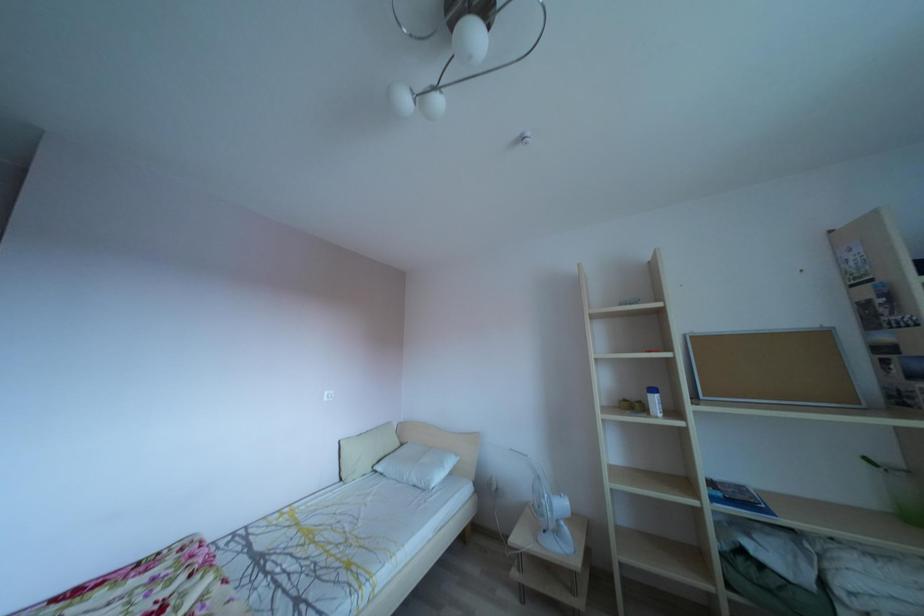
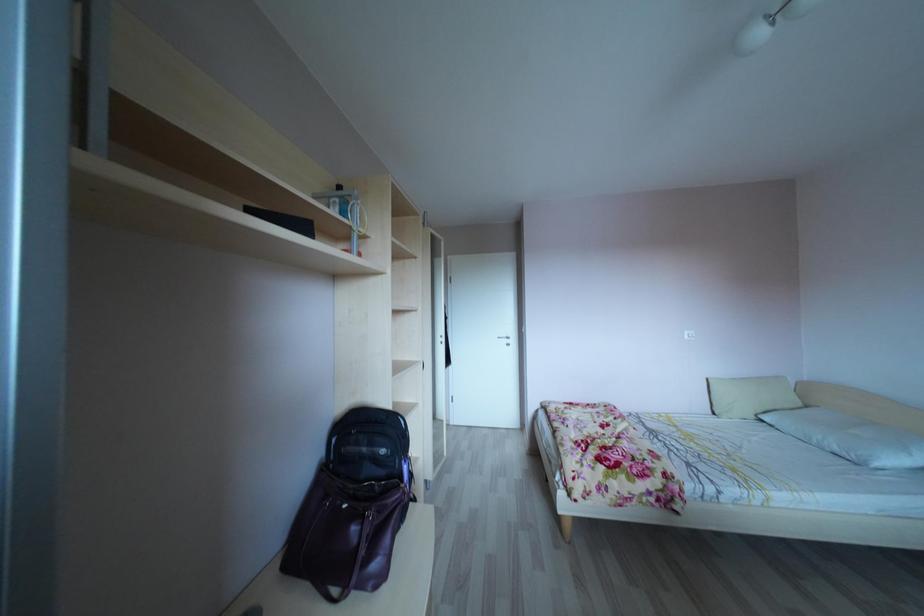
Question: The camera is either moving clockwise (left) or counter-clockwise (right) around the object. The first image is from the beginning of the video and the second image is from the end. Is the camera moving left or right when shooting the video?

Choices:
 (A) Left
 (B) Right

Answer: (B)